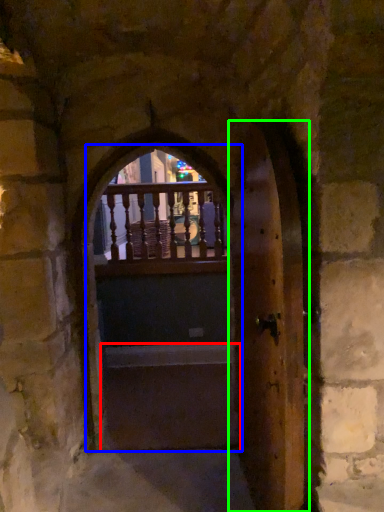
Question: Estimate the real-world distances between objects in this image. Which object is farther from stairwell (highlighted by a red box), door (highlighted by a blue box) or door (highlighted by a green box)?

Choices:
 (A) door
 (B) door

Answer: (B)